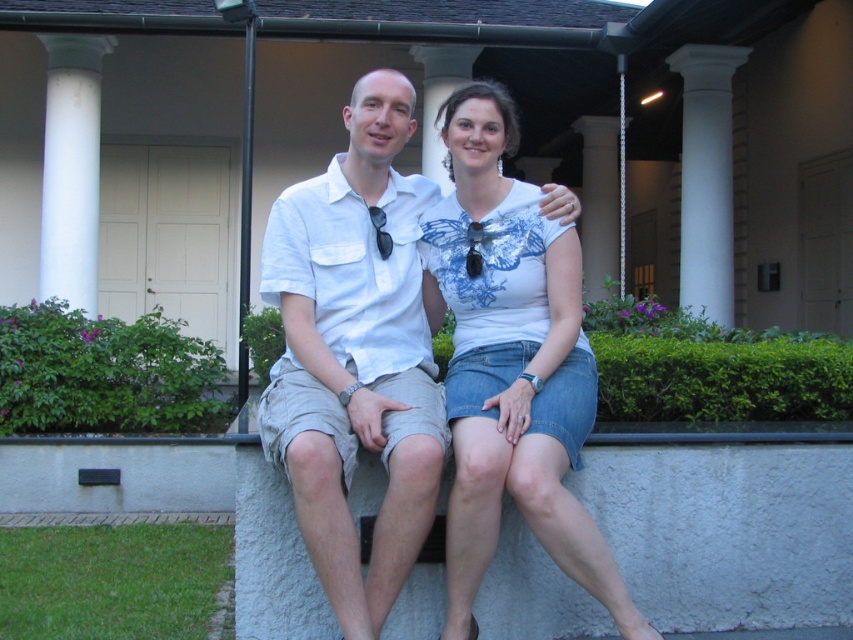
Is white cotton shirt at center to the left of white stone pillar at center from the viewer's perspective?

Correct, you'll find white cotton shirt at center to the left of white stone pillar at center.

Consider the image. Between white cotton shirt at center and white stone pillar at center, which one has more height?

Standing taller between the two is white cotton shirt at center.

Which is behind, point (329, 324) or point (440, 60)?

The point (440, 60) is more distant.

At what (x,y) coordinates should I click in order to perform the action: click on white cotton shirt at center. Please return your answer as a coordinate pair (x, y). The image size is (853, 640). Looking at the image, I should click on (357, 353).

Is white cotton shirt at center bigger than white marble pillar at center?

Actually, white cotton shirt at center might be smaller than white marble pillar at center.

Is point (312, 332) more distant than point (590, 179)?

No.

Does point (311, 458) come closer to viewer compared to point (583, 221)?

That is True.

Where is `white cotton shirt at center`? Image resolution: width=853 pixels, height=640 pixels. white cotton shirt at center is located at coordinates (357, 353).

Does white smooth column at right have a smaller size compared to white marble pillar at center?

Correct, white smooth column at right occupies less space than white marble pillar at center.

Who is more forward, (x=694, y=109) or (x=593, y=280)?

Point (x=694, y=109)

Locate an element on the screen. The image size is (853, 640). white smooth column at right is located at coordinates (706, 179).